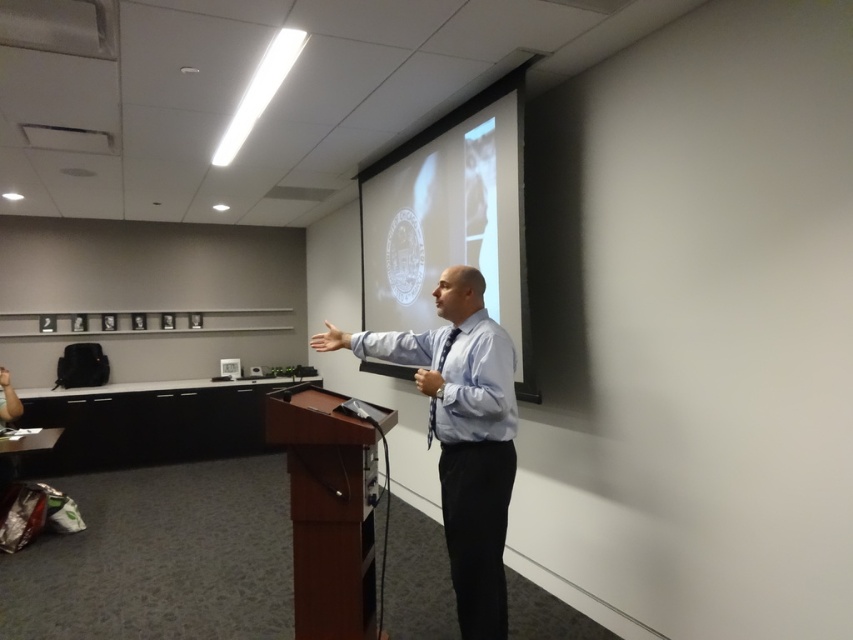
Which of these two, white glossy projection screen at upper center or blue shirt at center, stands shorter?

With less height is blue shirt at center.

Looking at this image, can you confirm if white glossy projection screen at upper center is positioned above blue shirt at center?

Indeed, white glossy projection screen at upper center is positioned over blue shirt at center.

Describe the element at coordinates (450, 218) in the screenshot. I see `white glossy projection screen at upper center` at that location.

The width and height of the screenshot is (853, 640). What are the coordinates of `white glossy projection screen at upper center` in the screenshot? It's located at (450, 218).

Does blue shirt at center lie behind brown wood podium at center?

No, blue shirt at center is closer to the viewer.

Is point (438, 412) positioned after point (322, 566)?

No, it is in front of (322, 566).

Find the location of a particular element. This screenshot has height=640, width=853. blue shirt at center is located at coordinates (461, 435).

Does point (454, 164) come closer to viewer compared to point (354, 458)?

That is False.

Does white glossy projection screen at upper center have a greater height compared to brown wood podium at center?

Indeed, white glossy projection screen at upper center has a greater height compared to brown wood podium at center.

Is point (434, 180) more distant than point (338, 460)?

Yes, it is.

The width and height of the screenshot is (853, 640). Identify the location of white glossy projection screen at upper center. (450, 218).